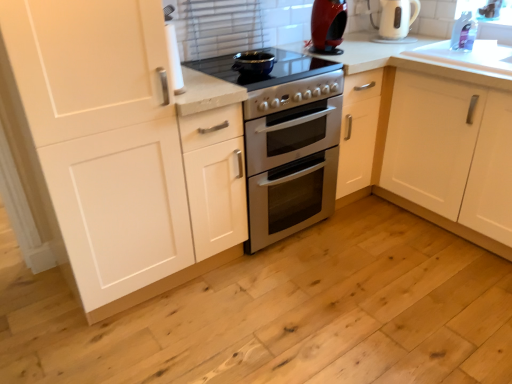
Identify the location of vacant space to the right of white matte cabinet at left. (239, 301).